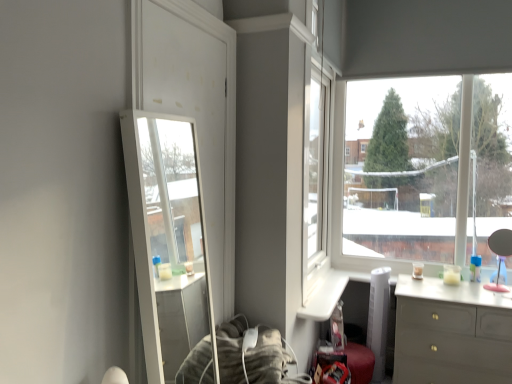
Identify the location of free space above matte gray dresser at lower right (from a real-world perspective). (464, 286).